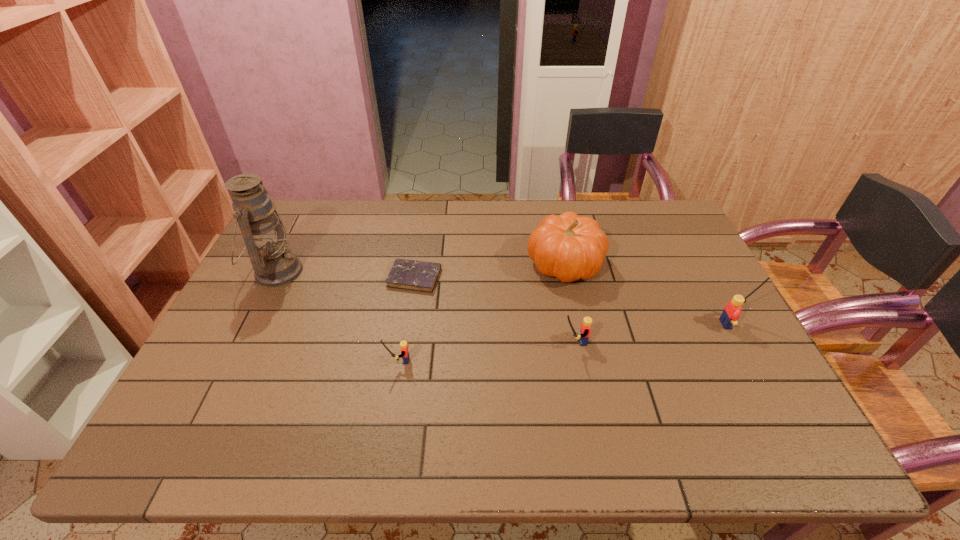
This screenshot has width=960, height=540. I want to click on Lego that is the second closest to the shortest object, so click(x=585, y=328).

Find the location of a particular element. The image size is (960, 540). Lego that stands as the closest to the rightmost Lego is located at coordinates (585, 328).